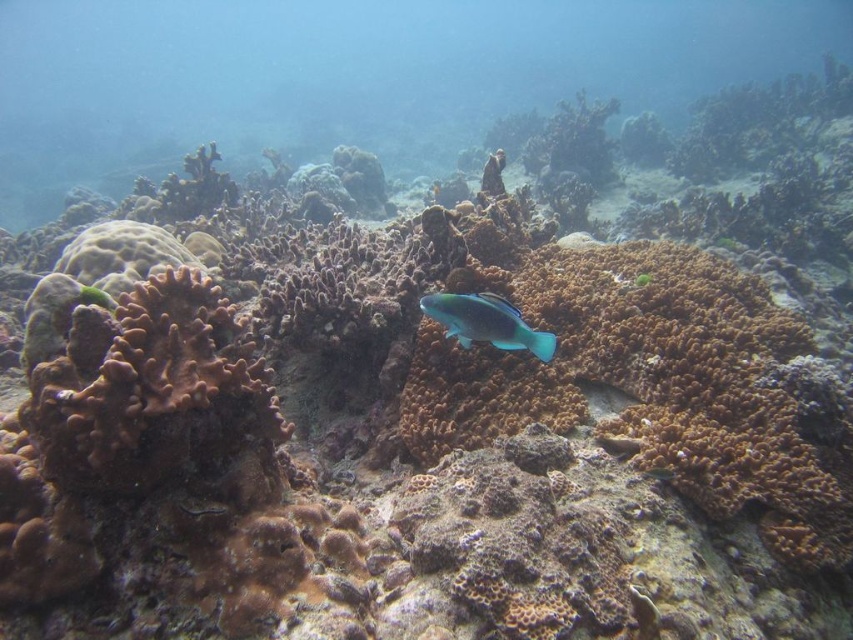
Consider the image. You are an underwater photographer aiming to capture a closeup shot of the coral reef. You have two points marked in the scene, point A at coordinates point (94, 392) and point B at coordinates point (469, 320). Which point should you focus on to ensure the subject is in focus if you want the closest object to the camera to be sharp?

You should focus on point A at coordinates point (94, 392) because it is closer to the camera than point B at coordinates point (469, 320).

You are a marine biologist observing the underwater scene. You notice the brown rough coral at left and the teal glossy fish at center. Based on their positions, which object is wider?

The brown rough coral at left might be wider than the teal glossy fish at center according to the description.

You are a marine biologist observing the underwater scene. You notice the brown rough coral at left and the teal glossy fish at center. Based on their positions, which object is closer to the left edge of the image?

The brown rough coral at left is closer to the left edge of the image because it is positioned to the left of the teal glossy fish at center.